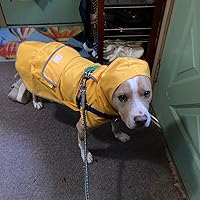
Locate an element on the screen. grey floor is located at coordinates (124, 185).